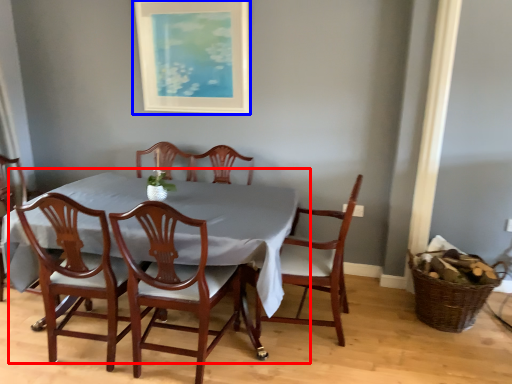
Question: Among these objects, which one is nearest to the camera, kitchen & dining room table (highlighted by a red box) or picture frame (highlighted by a blue box)?

Choices:
 (A) kitchen & dining room table
 (B) picture frame

Answer: (A)